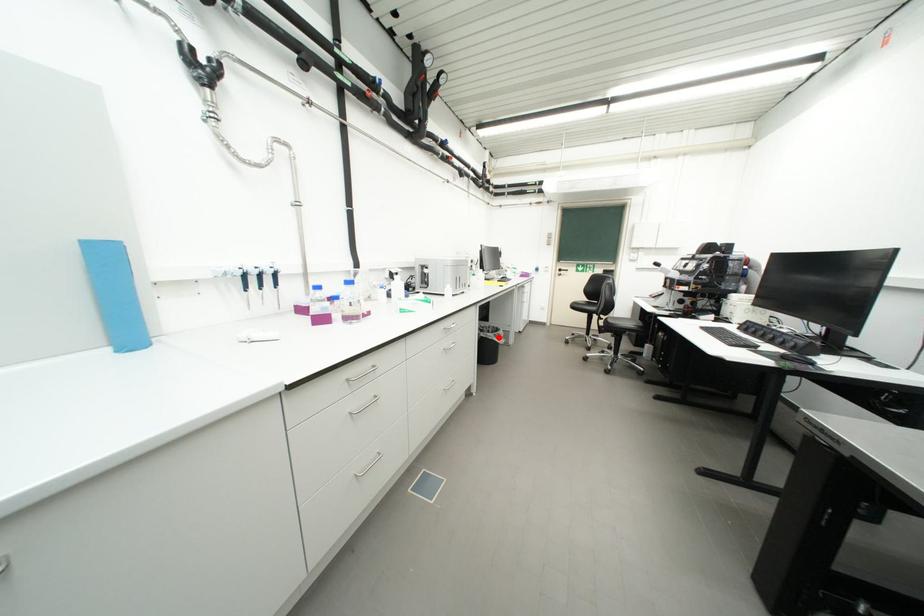
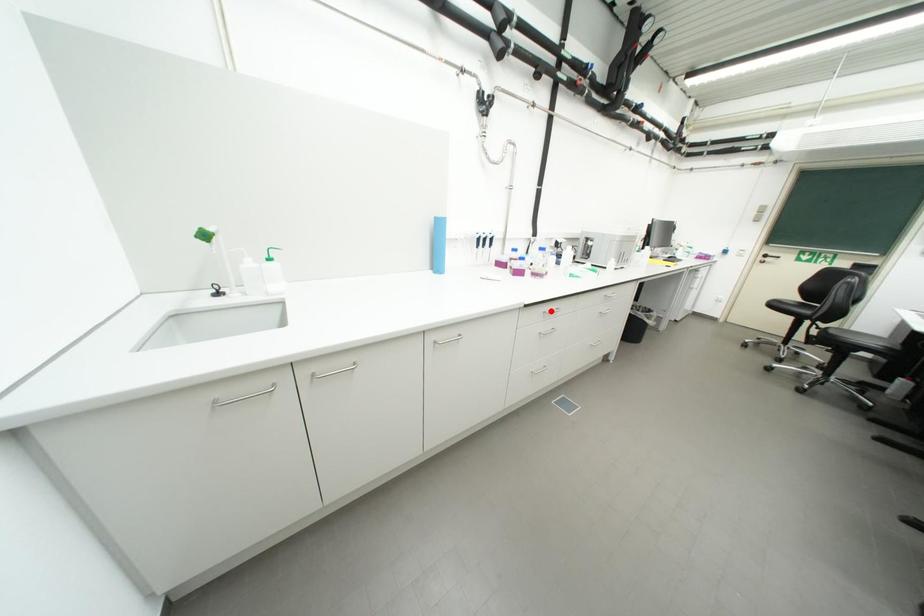
I am providing you with two images of the same scene from different viewpoints. A red point is marked on the first image and another point is marked on the second image. Are the points marked in image1 and image2 representing the same 3D position?

No